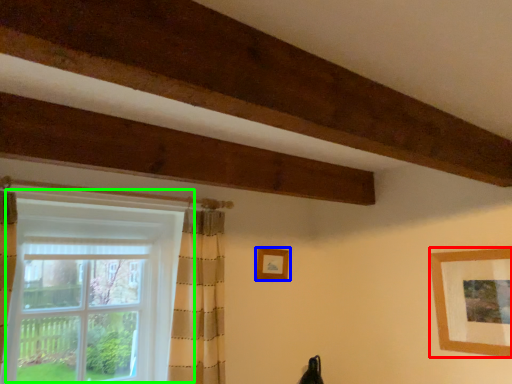
Question: Estimate the real-world distances between objects in this image. Which object is farther from picture frame (highlighted by a red box), picture frame (highlighted by a blue box) or window (highlighted by a green box)?

Choices:
 (A) picture frame
 (B) window

Answer: (B)